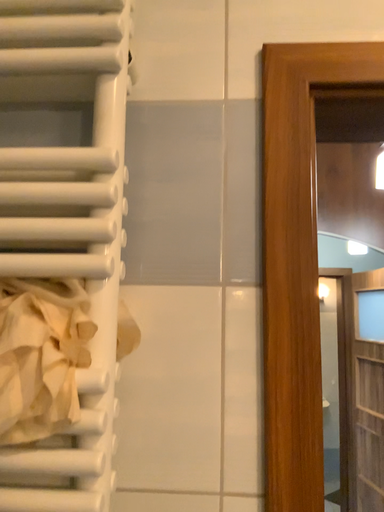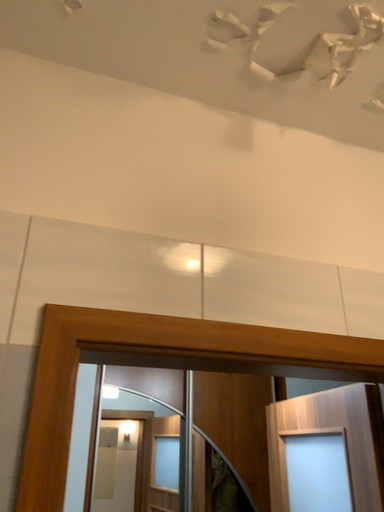
Question: Which way did the camera rotate in the video?

Choices:
 (A) rotated left
 (B) rotated right

Answer: (B)